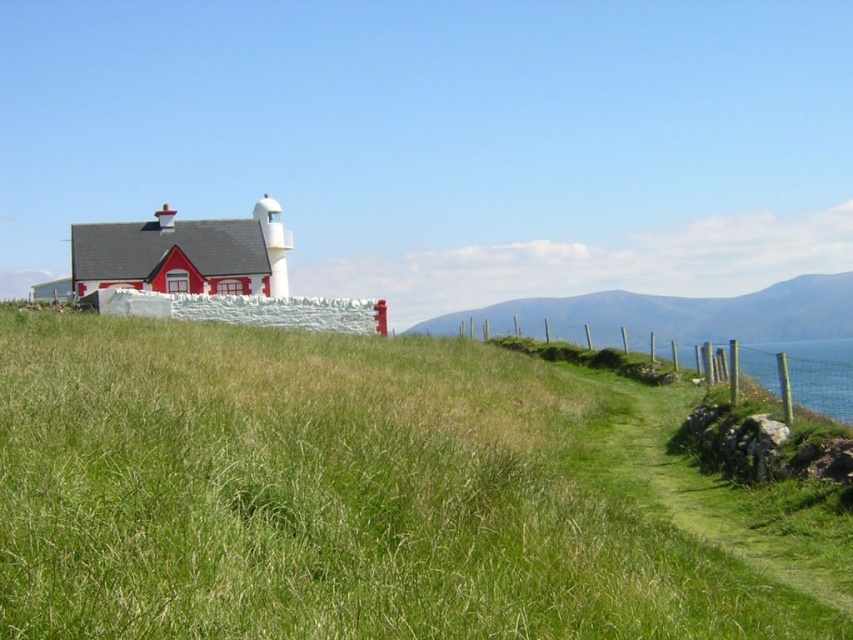
Question: Estimate the real-world distances between objects in this image. Which object is closer to the green grassy at center?

Choices:
 (A) green grassy hillside at center
 (B) green grassy path at center-right

Answer: (B)

Question: Does green grassy at center appear on the left side of green grassy hillside at center?

Choices:
 (A) no
 (B) yes

Answer: (B)

Question: Does green grassy at center appear on the left side of green grassy hillside at center?

Choices:
 (A) no
 (B) yes

Answer: (B)

Question: Which object is farther from the camera taking this photo?

Choices:
 (A) green grassy hillside at center
 (B) green grassy path at center-right

Answer: (A)

Question: Can you confirm if green grassy at center is positioned to the right of green grassy path at center-right?

Choices:
 (A) no
 (B) yes

Answer: (A)

Question: Which point is closer to the camera?

Choices:
 (A) green grassy path at center-right
 (B) green grassy hillside at center
 (C) green grassy at center

Answer: (C)